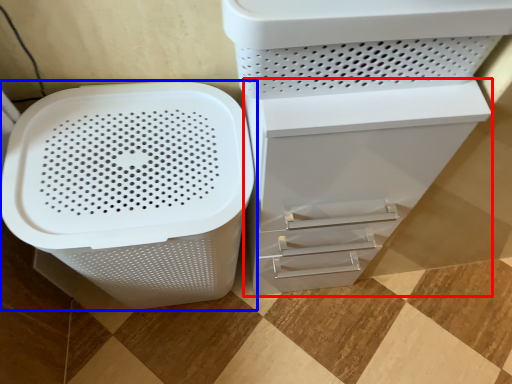
Question: Which point is further to the camera, file cabinet (highlighted by a red box) or waste container (highlighted by a blue box)?

Choices:
 (A) file cabinet
 (B) waste container

Answer: (B)